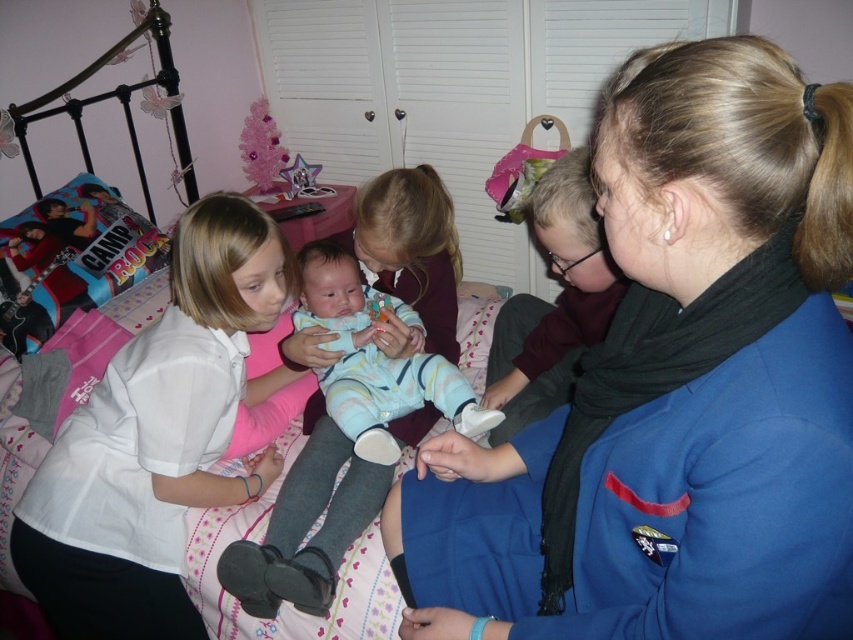
You are a tailor trying to decide which garment to place on a mannequin first. The blue uniform at center and the white matte shirt at center are both on a rack. According to their sizes, which one should you put on the mannequin first?

The blue uniform at center has a lesser height compared to the white matte shirt at center. Therefore, you should place the white matte shirt at center first since it is taller and needs to be positioned properly before the shorter blue uniform at center.

You are a photographer positioned in the room and want to capture a closeup of the white matte shirt at center and the light blue fabric baby at center. Which one will appear larger in the photo?

The white matte shirt at center will appear larger in the photo because it is closer to the viewer than the light blue fabric baby at center.